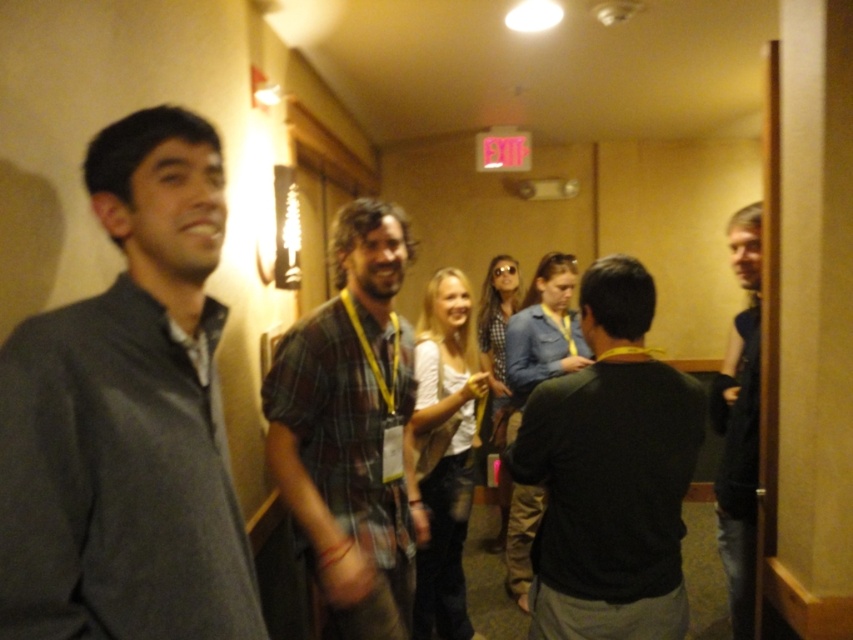
Where is `matte gray shirt at left`? The image size is (853, 640). matte gray shirt at left is located at coordinates (128, 417).

Can you confirm if matte gray shirt at left is taller than plaid fabric shirt at center?

In fact, matte gray shirt at left may be shorter than plaid fabric shirt at center.

Is point (90, 342) behind point (383, 333)?

No, it is not.

Find the location of `matte gray shirt at left`. matte gray shirt at left is located at coordinates (128, 417).

Can you confirm if dark gray shirt at center is smaller than dark blue sweater at right?

Yes.

Consider the image. Between dark gray shirt at center and dark blue sweater at right, which one has more height?

With more height is dark blue sweater at right.

Does point (560, 451) lie in front of point (718, 547)?

Yes, point (560, 451) is closer to viewer.

At what (x,y) coordinates should I click in order to perform the action: click on dark gray shirt at center. Please return your answer as a coordinate pair (x, y). This screenshot has height=640, width=853. Looking at the image, I should click on (610, 474).

Does point (32, 508) lie behind point (624, 433)?

No, it is not.

Does point (24, 420) come closer to viewer compared to point (547, 612)?

Yes, point (24, 420) is closer to viewer.

Is point (171, 614) closer to camera compared to point (641, 454)?

Yes, point (171, 614) is in front of point (641, 454).

The image size is (853, 640). Identify the location of matte gray shirt at left. (128, 417).